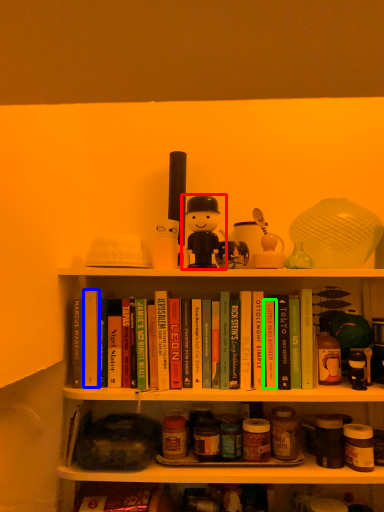
Question: Based on their relative distances, which object is nearer to toy (highlighted by a red box)? Choose from paperback book (highlighted by a blue box) and paperback book (highlighted by a green box).

Choices:
 (A) paperback book
 (B) paperback book

Answer: (B)